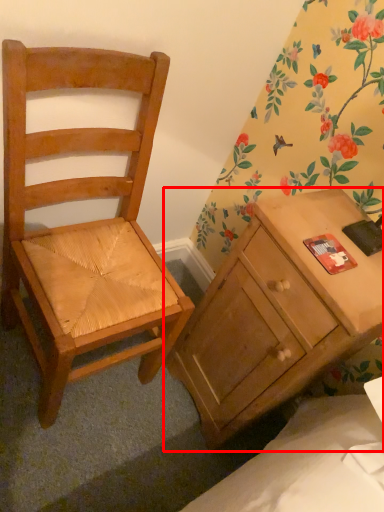
Question: Considering the relative positions of desk (annotated by the red box) and chair in the image provided, where is desk (annotated by the red box) located with respect to the staircase?

Choices:
 (A) left
 (B) right

Answer: (B)